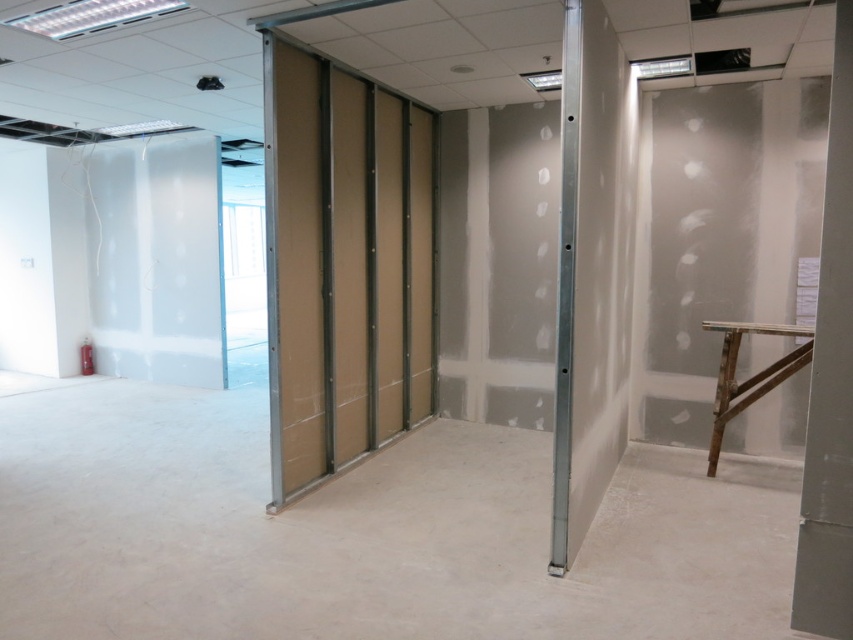
Between metallic silver pillar at center and white smooth pillar at right, which one is positioned higher?

Positioned higher is metallic silver pillar at center.

Can you confirm if metallic silver pillar at center is smaller than white smooth pillar at right?

Actually, metallic silver pillar at center might be larger than white smooth pillar at right.

Is point (563, 388) closer to viewer compared to point (849, 492)?

No, (563, 388) is further to viewer.

Identify the location of metallic silver pillar at center. (590, 275).